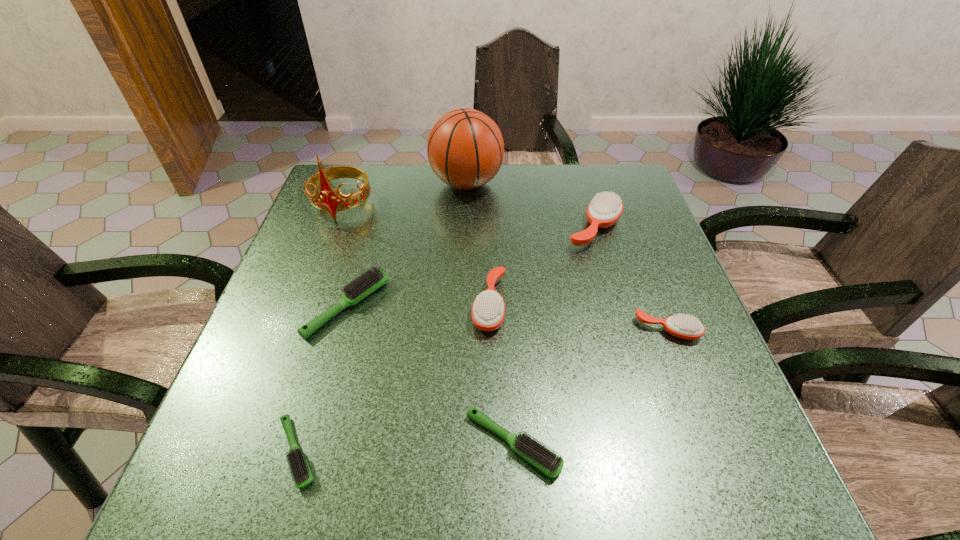
Find the location of a particular element. basketball at the far edge is located at coordinates (465, 148).

Locate an element on the screen. tiara that is at the far edge is located at coordinates (327, 199).

Identify the location of hairbrush that is at the far edge. Image resolution: width=960 pixels, height=540 pixels. (605, 209).

You are a GUI agent. You are given a task and a screenshot of the screen. Output one action in this format:
    pyautogui.click(x=<x>, y=<y>)
    Task: Click on the tiara present at the left edge
    
    Given the screenshot: What is the action you would take?
    pyautogui.click(x=327, y=199)

You are a GUI agent. You are given a task and a screenshot of the screen. Output one action in this format:
    pyautogui.click(x=<x>, y=<y>)
    Task: Click on the object that is positioned at the far left corner
    This screenshot has height=540, width=960.
    Given the screenshot: What is the action you would take?
    pyautogui.click(x=327, y=199)

Identify the location of object at the near left corner. The image size is (960, 540). (302, 476).

Locate an element on the screen. This screenshot has height=540, width=960. object at the far right corner is located at coordinates (605, 209).

The image size is (960, 540). What are the coordinates of `free space at the far edge` in the screenshot? It's located at (443, 186).

In the image, there is a desktop. Where is `vacant space at the near edge`? This screenshot has height=540, width=960. vacant space at the near edge is located at coordinates tap(630, 465).

This screenshot has width=960, height=540. What are the coordinates of `vacant space at the left edge of the desktop` in the screenshot? It's located at (351, 272).